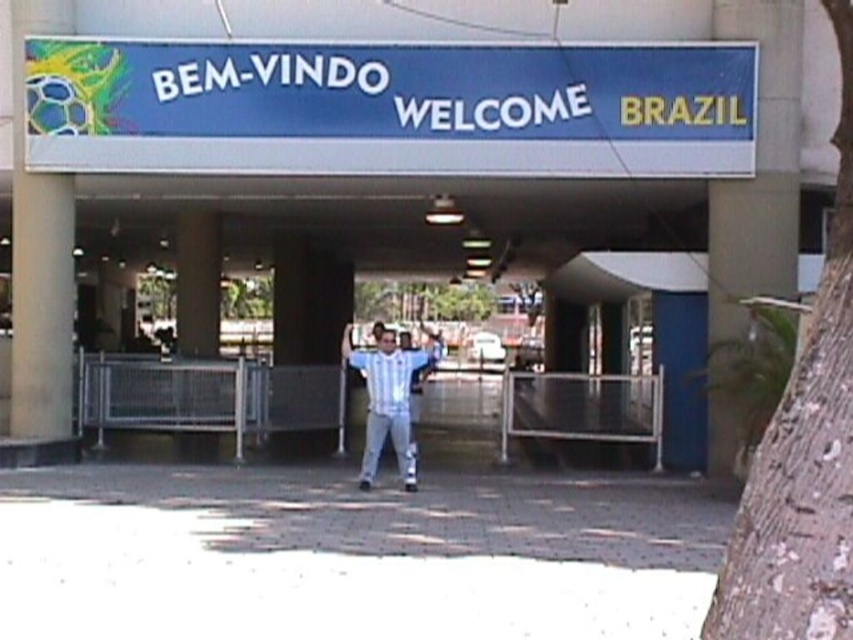
You are designing a layout for a new exhibit and need to place a large poster. The poster is wider than the smooth concrete pillar at upper left. Will it fit next to the white fabric shirt at center?

The smooth concrete pillar at upper left occupies less space than the white fabric shirt at center, so the poster wider than the pillar may not fit next to the white fabric shirt at center since the shirt occupies more space.

You are standing at the entrance area under the large signboard and want to move from point [834,74] to point [360,369]. Which direction should you move relative to the entrance area?

You should move away from the entrance area towards the back because point [360,369] is further away from the viewer compared to point [834,74].